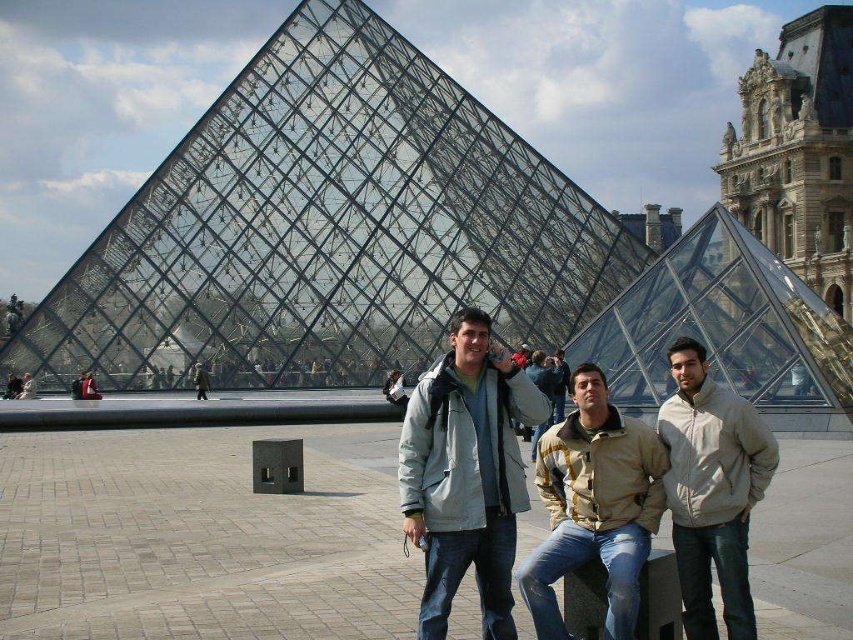
Who is positioned more to the left, transparent glass pyramid at center or light gray jacket at center?

transparent glass pyramid at center is more to the left.

Between transparent glass pyramid at center and light gray jacket at center, which one is positioned lower?

light gray jacket at center is below.

Between point (323, 305) and point (514, 365), which one is positioned in front?

Point (514, 365) is more forward.

The height and width of the screenshot is (640, 853). I want to click on transparent glass pyramid at center, so click(329, 228).

Does point (592, 481) come in front of point (724, 604)?

No, (592, 481) is behind (724, 604).

Does point (567, 442) come behind point (682, 492)?

Yes.

Locate an element on the screen. The width and height of the screenshot is (853, 640). beige fabric jacket at center is located at coordinates (595, 506).

Is light gray jacket at center below beige fabric jacket at center?

No, light gray jacket at center is not below beige fabric jacket at center.

Between light gray jacket at center and beige fabric jacket at center, which one appears on the left side from the viewer's perspective?

Positioned to the left is light gray jacket at center.

Who is more forward, (498,586) or (627,564)?

Point (627,564) is more forward.

Where is `light gray jacket at center`? This screenshot has width=853, height=640. light gray jacket at center is located at coordinates (466, 474).